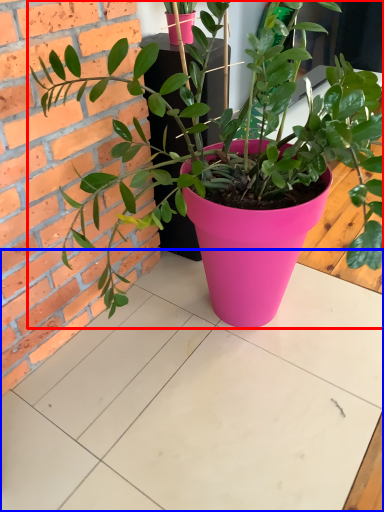
Question: Which point is closer to the camera, houseplant (highlighted by a red box) or table (highlighted by a blue box)?

Choices:
 (A) houseplant
 (B) table

Answer: (A)